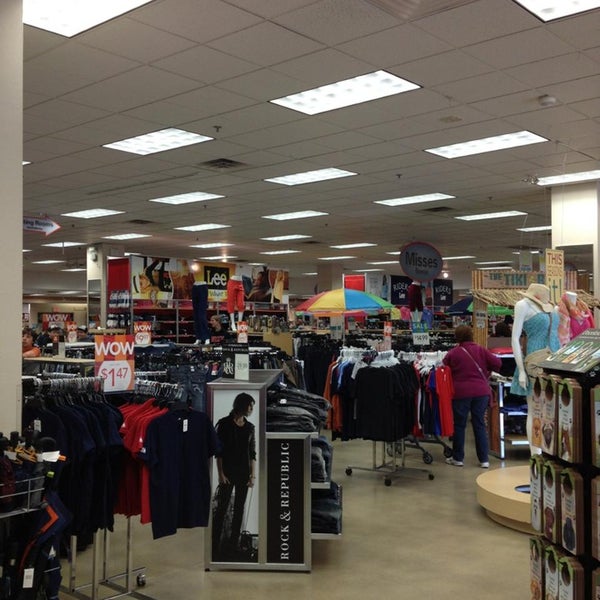
Identify the location of floor. (409, 527).